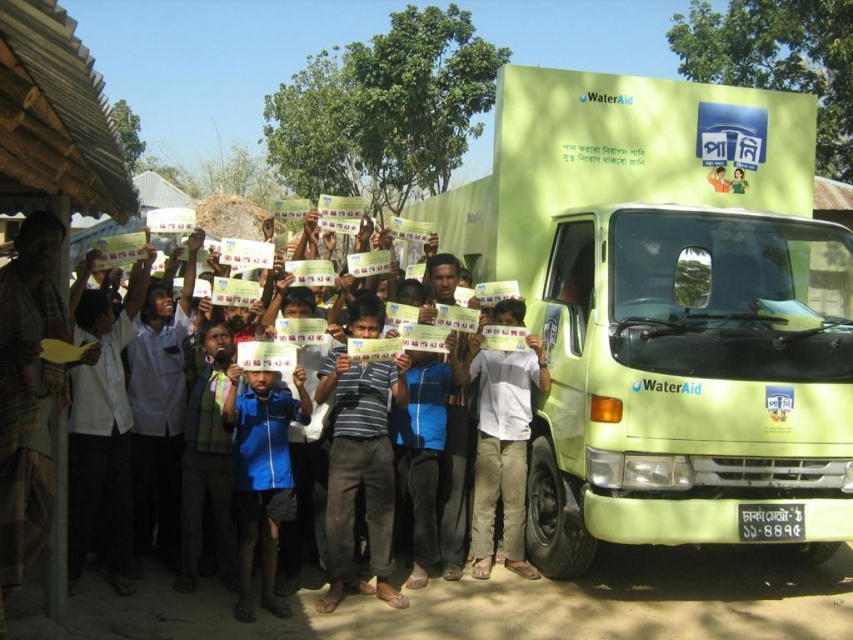
Is light blue shirt at center shorter than blue fabric shirt at center?

Incorrect, light blue shirt at center's height does not fall short of blue fabric shirt at center's.

Does light blue shirt at center lie in front of blue fabric shirt at center?

No.

Who is more distant from viewer, (525, 419) or (239, 593)?

Point (525, 419)

The width and height of the screenshot is (853, 640). In order to click on light blue shirt at center in this screenshot , I will do `click(502, 451)`.

Between point (717, 305) and point (242, 428), which one is positioned in front?

Positioned in front is point (242, 428).

Does green matte truck at center lie behind blue fabric shirt at center?

That is False.

Is point (798, 115) closer to camera compared to point (236, 384)?

No, (798, 115) is behind (236, 384).

I want to click on green matte truck at center, so click(668, 310).

Does green matte truck at center appear over light blue shirt at center?

Yes, green matte truck at center is above light blue shirt at center.

Who is more distant from viewer, (624,500) or (511,404)?

Positioned behind is point (511,404).

Who is more distant from viewer, (x=850, y=522) or (x=532, y=369)?

Point (x=532, y=369)

The height and width of the screenshot is (640, 853). What are the coordinates of `green matte truck at center` in the screenshot? It's located at (668, 310).